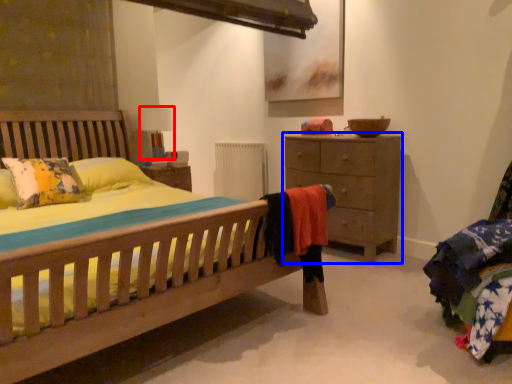
Question: Among these objects, which one is farthest to the camera, table lamp (highlighted by a red box) or chest of drawers (highlighted by a blue box)?

Choices:
 (A) table lamp
 (B) chest of drawers

Answer: (A)